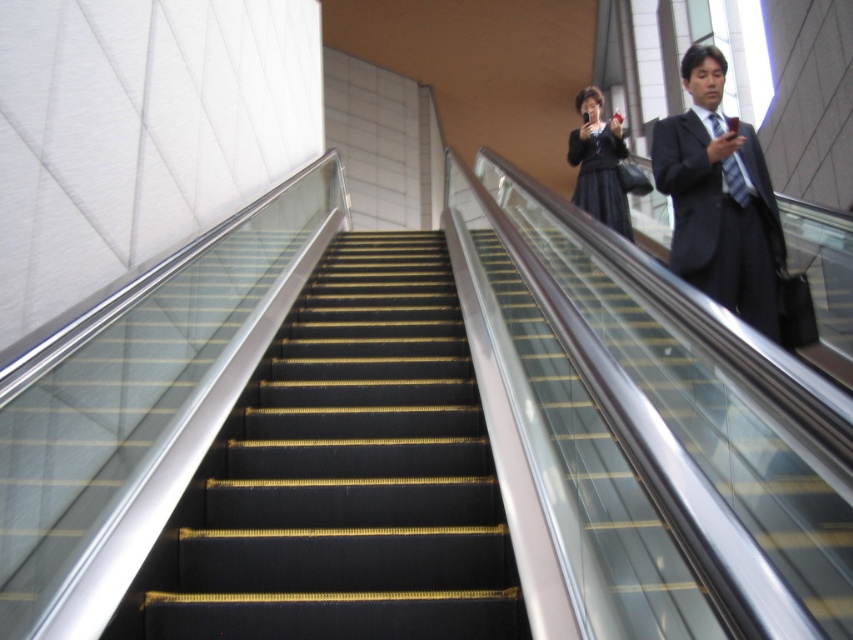
Question: Considering the relative positions of black rubber stairs at center and dark gray suit at upper right in the image provided, where is black rubber stairs at center located with respect to dark gray suit at upper right?

Choices:
 (A) below
 (B) above

Answer: (A)

Question: Observing the image, what is the correct spatial positioning of black rubber stairs at center in reference to dark gray suit at upper right?

Choices:
 (A) left
 (B) right

Answer: (A)

Question: In this image, where is black rubber stairs at center located relative to dark gray suit at upper right?

Choices:
 (A) left
 (B) right

Answer: (A)